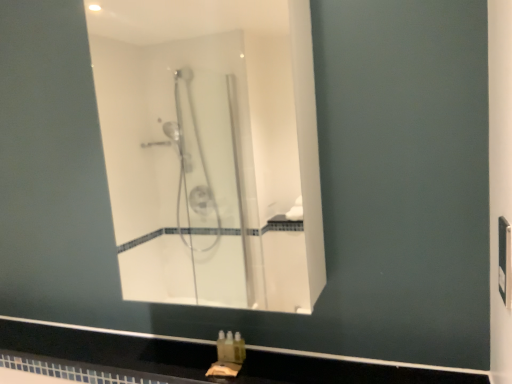
Question: Does black glossy counter top at lower center appear on the left side of clear glass shower at center?

Choices:
 (A) no
 (B) yes

Answer: (B)

Question: Can you confirm if black glossy counter top at lower center is bigger than clear glass shower at center?

Choices:
 (A) yes
 (B) no

Answer: (B)

Question: Considering the relative sizes of black glossy counter top at lower center and clear glass shower at center in the image provided, is black glossy counter top at lower center wider than clear glass shower at center?

Choices:
 (A) yes
 (B) no

Answer: (A)

Question: Does black glossy counter top at lower center have a lesser width compared to clear glass shower at center?

Choices:
 (A) no
 (B) yes

Answer: (A)

Question: From a real-world perspective, is black glossy counter top at lower center positioned under clear glass shower at center based on gravity?

Choices:
 (A) yes
 (B) no

Answer: (A)

Question: From the image's perspective, would you say black glossy counter top at lower center is positioned over clear glass shower at center?

Choices:
 (A) no
 (B) yes

Answer: (A)

Question: Is translucent plastic soap at lower center bigger than clear glass shower at center?

Choices:
 (A) no
 (B) yes

Answer: (A)

Question: Is the depth of translucent plastic soap at lower center greater than that of clear glass shower at center?

Choices:
 (A) yes
 (B) no

Answer: (A)

Question: Is translucent plastic soap at lower center shorter than clear glass shower at center?

Choices:
 (A) no
 (B) yes

Answer: (B)

Question: From the image's perspective, is translucent plastic soap at lower center below clear glass shower at center?

Choices:
 (A) no
 (B) yes

Answer: (B)

Question: From a real-world perspective, is translucent plastic soap at lower center over clear glass shower at center?

Choices:
 (A) yes
 (B) no

Answer: (B)

Question: Is translucent plastic soap at lower center located outside clear glass shower at center?

Choices:
 (A) yes
 (B) no

Answer: (A)

Question: Is translucent plastic soap at lower center next to black glossy counter top at lower center and touching it?

Choices:
 (A) no
 (B) yes

Answer: (A)